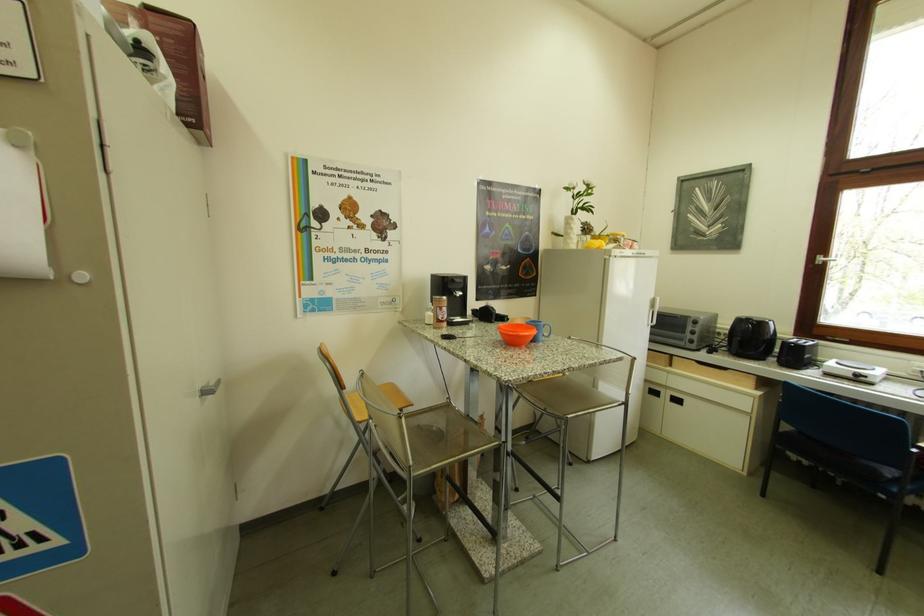
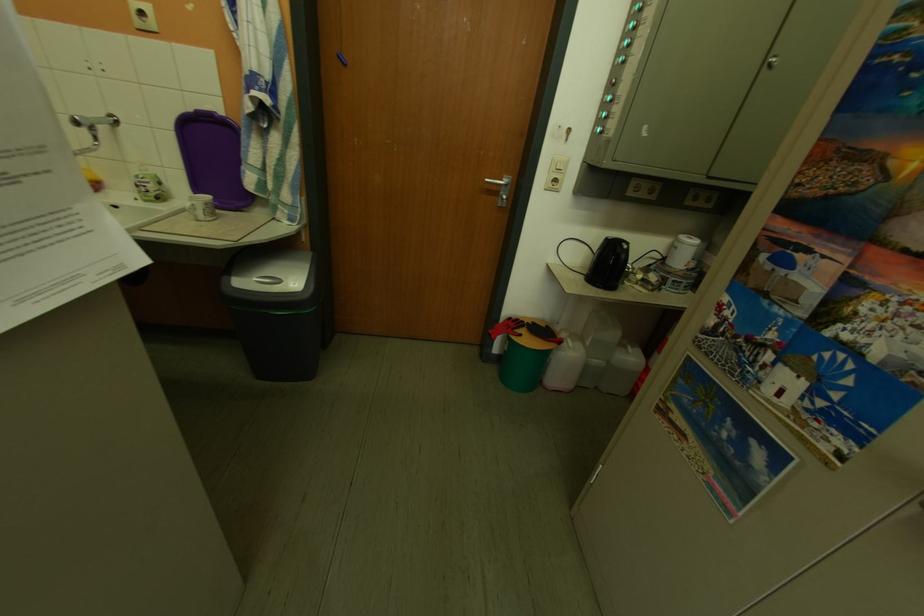
First-person continuous shooting, in which direction is the camera rotating?

The camera's rotation is toward left-down.